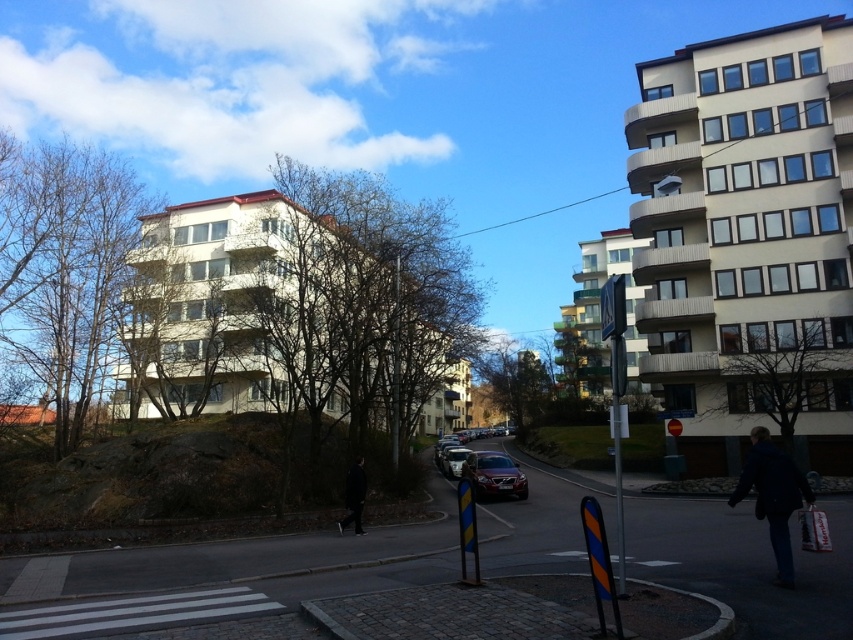
Question: Is satin silver sedan at center to the right of shiny silver car at center from the viewer's perspective?

Choices:
 (A) no
 (B) yes

Answer: (B)

Question: Which object is the closest to the dark blue jacket at lower right?

Choices:
 (A) satin silver sedan at center
 (B) shiny silver car at center
 (C) reflective silver sign at center

Answer: (C)

Question: Considering the relative positions of dark blue jacket at lower right and satin silver sedan at center in the image provided, where is dark blue jacket at lower right located with respect to satin silver sedan at center?

Choices:
 (A) above
 (B) below

Answer: (A)

Question: Which object is farther from the camera taking this photo?

Choices:
 (A) black matte jacket at lower center
 (B) shiny silver car at center
 (C) dark blue jacket at lower right

Answer: (B)

Question: Is the position of reflective silver sign at center less distant than that of shiny silver car at center?

Choices:
 (A) yes
 (B) no

Answer: (A)

Question: Which object is positioned closest to the black matte jacket at lower center?

Choices:
 (A) satin silver sedan at center
 (B) shiny silver car at center
 (C) reflective silver sign at center

Answer: (C)